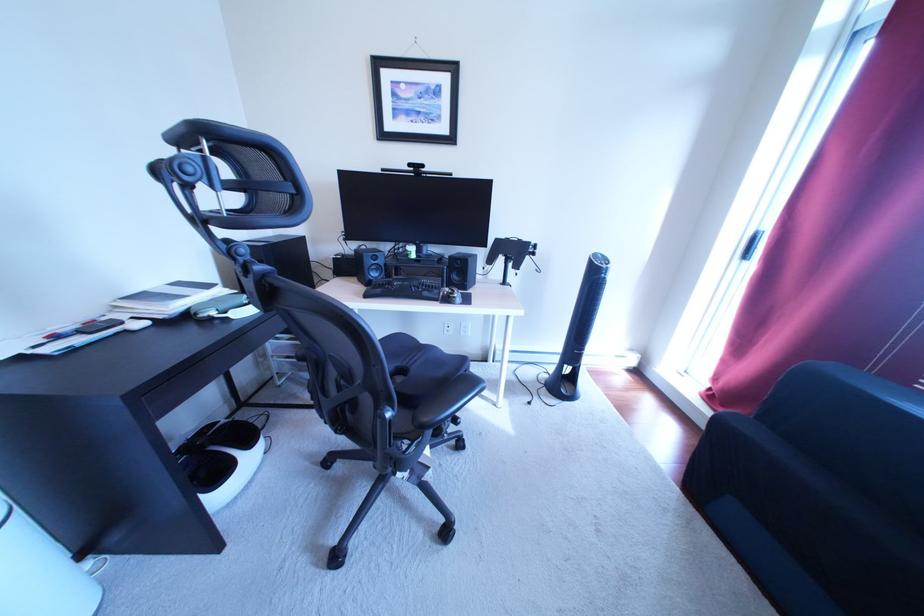
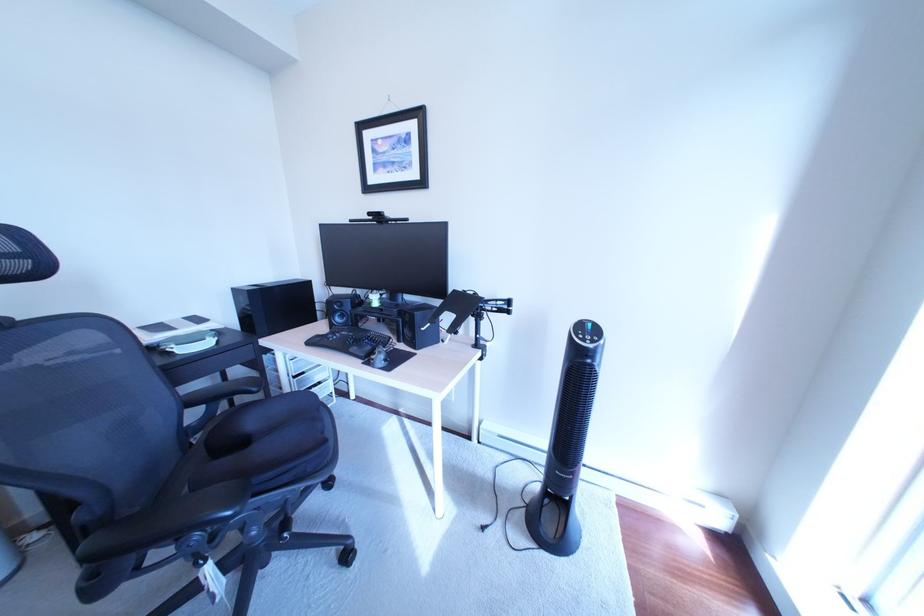
Which direction would the cameraman need to move to produce the second image?

The movement direction of the cameraman is right, forward.